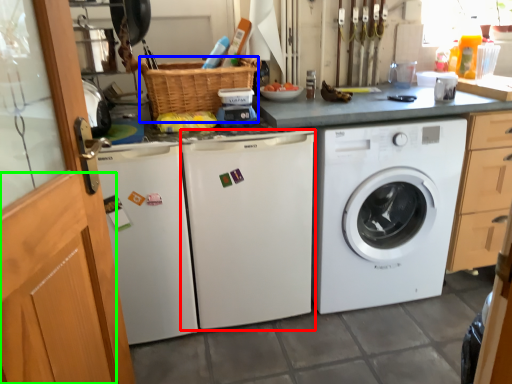
Question: Which is nearer to the washing machine (highlighted by a red box)? basket (highlighted by a blue box) or screen door (highlighted by a green box).

Choices:
 (A) basket
 (B) screen door

Answer: (A)